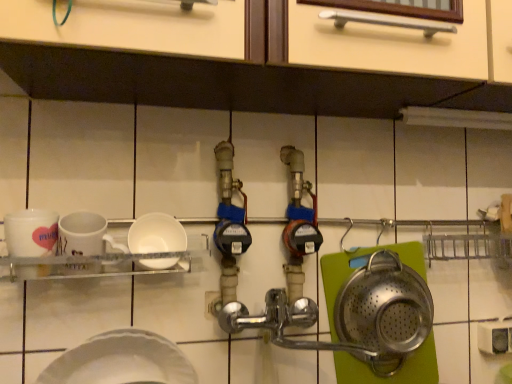
Question: Does point (113, 352) appear closer or farther from the camera than point (40, 243)?

Choices:
 (A) closer
 (B) farther

Answer: (A)

Question: From the image's perspective, relative to white glossy mug at left, is white matte plate at lower left, the second plate in the top-to-bottom sequence, above or below?

Choices:
 (A) below
 (B) above

Answer: (A)

Question: Which of these objects is positioned closest to the white matte bowl at center, the first plate when ordered from top to bottom?

Choices:
 (A) white matte plate at lower left, the 1th plate in the bottom-to-top sequence
 (B) white glossy mug at left

Answer: (B)

Question: Which object is positioned farthest from the white matte plate at lower left, the 1th plate in the bottom-to-top sequence?

Choices:
 (A) white glossy mug at left
 (B) white matte bowl at center, which is the 2th plate from bottom to top

Answer: (A)